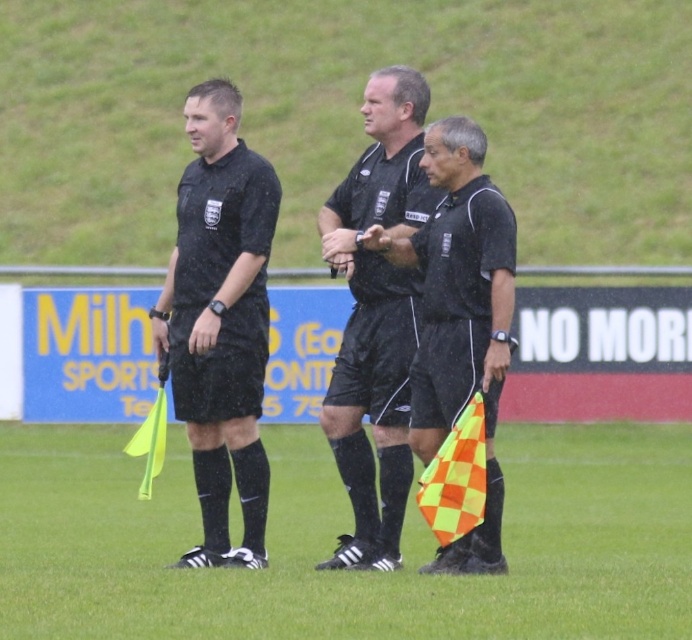
Question: Which of these objects is positioned farthest from the matte black flag at center?

Choices:
 (A) matte black shorts at left
 (B) orange checkered flag at lower center

Answer: (B)

Question: Which point is closer to the camera taking this photo?

Choices:
 (A) (352, 362)
 (B) (268, 204)

Answer: (A)

Question: Among these points, which one is nearest to the camera?

Choices:
 (A) [x=336, y=460]
 (B) [x=170, y=348]

Answer: (A)

Question: Where is matte black shorts at left located in relation to matte black flag at center in the image?

Choices:
 (A) below
 (B) above

Answer: (B)

Question: Is the position of orange checkered flag at lower center less distant than that of matte black shorts at left?

Choices:
 (A) yes
 (B) no

Answer: (A)

Question: Does matte black shorts at left have a smaller size compared to matte black flag at center?

Choices:
 (A) yes
 (B) no

Answer: (A)